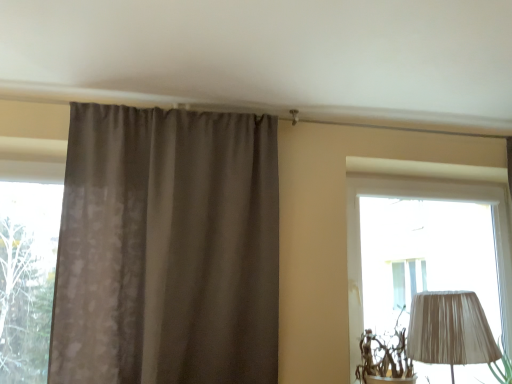
What do you see at coordinates (27, 278) in the screenshot? I see `transparent glass window at left` at bounding box center [27, 278].

Identify the location of transparent glass window at left. The width and height of the screenshot is (512, 384). (27, 278).

Identify the location of matte brown curtain at center. (167, 248).

The width and height of the screenshot is (512, 384). Describe the element at coordinates (167, 248) in the screenshot. I see `matte brown curtain at center` at that location.

Measure the distance between point (87,170) and camera.

Point (87,170) is 2.18 meters from camera.

Find the location of a particular element. The image size is (512, 384). transparent glass window at left is located at coordinates (27, 278).

In the scene shown: Is matte brown curtain at center to the left of transparent glass window at left from the viewer's perspective?

Incorrect, matte brown curtain at center is not on the left side of transparent glass window at left.

Is the depth of matte brown curtain at center greater than that of transparent glass window at left?

No, it is not.

Between point (148, 349) and point (10, 296), which one is positioned behind?

Positioned behind is point (10, 296).

In the scene shown: From the image's perspective, relative to transparent glass window at left, is matte brown curtain at center above or below?

matte brown curtain at center is above transparent glass window at left.

From a real-world perspective, is matte brown curtain at center physically above transparent glass window at left?

Yes, from a real-world perspective, matte brown curtain at center is above transparent glass window at left.

Which of these two, matte brown curtain at center or transparent glass window at left, is wider?

Wider between the two is matte brown curtain at center.

Can you confirm if matte brown curtain at center is shorter than transparent glass window at left?

Incorrect, the height of matte brown curtain at center does not fall short of that of transparent glass window at left.

Between matte brown curtain at center and transparent glass window at left, which one has larger size?

matte brown curtain at center is bigger.

Is matte brown curtain at center inside the boundaries of transparent glass window at left, or outside?

matte brown curtain at center lies outside transparent glass window at left.

Is matte brown curtain at center placed right next to transparent glass window at left?

No, matte brown curtain at center is not beside transparent glass window at left.

Could you tell me if matte brown curtain at center is turned towards transparent glass window at left?

No, matte brown curtain at center is not aimed at transparent glass window at left.

What's the angular difference between matte brown curtain at center and transparent glass window at left's facing directions?

The angle between the facing direction of matte brown curtain at center and the facing direction of transparent glass window at left is 0.88 degrees.

The image size is (512, 384). Find the location of `curtain located above the transparent glass window at left (from the image's perspective)`. curtain located above the transparent glass window at left (from the image's perspective) is located at coordinates (167, 248).

Which object is positioned more to the right, transparent glass window at left or matte brown curtain at center?

From the viewer's perspective, matte brown curtain at center appears more on the right side.

Is transparent glass window at left closer to the viewer compared to matte brown curtain at center?

No, it is not.

Between point (7, 216) and point (249, 359), which one is positioned behind?

The point (7, 216) is behind.

From the image's perspective, is transparent glass window at left over matte brown curtain at center?

No, from the image's perspective, transparent glass window at left is not over matte brown curtain at center.

From a real-world perspective, is transparent glass window at left on top of matte brown curtain at center?

No, from a real-world perspective, transparent glass window at left is not on top of matte brown curtain at center.

Based on the photo, does transparent glass window at left have a lesser width compared to matte brown curtain at center?

Indeed, transparent glass window at left has a lesser width compared to matte brown curtain at center.

Considering the sizes of objects transparent glass window at left and matte brown curtain at center in the image provided, who is shorter, transparent glass window at left or matte brown curtain at center?

transparent glass window at left.

Which of these two, transparent glass window at left or matte brown curtain at center, is bigger?

With larger size is matte brown curtain at center.

Is transparent glass window at left not inside matte brown curtain at center?

Yes, transparent glass window at left is not within matte brown curtain at center.

Would you consider transparent glass window at left to be distant from matte brown curtain at center?

That's not correct — transparent glass window at left is a little close to matte brown curtain at center.

Could you tell me if transparent glass window at left is turned towards matte brown curtain at center?

No, transparent glass window at left is not turned towards matte brown curtain at center.

What's the angular difference between transparent glass window at left and matte brown curtain at center's facing directions?

0.88 degrees.

You are a GUI agent. You are given a task and a screenshot of the screen. Output one action in this format:
    pyautogui.click(x=<x>, y=<y>)
    Task: Click on the window below the matte brown curtain at center (from the image's perspective)
    
    Given the screenshot: What is the action you would take?
    pyautogui.click(x=27, y=278)

Image resolution: width=512 pixels, height=384 pixels. Find the location of `curtain located above the transparent glass window at left (from the image's perspective)`. curtain located above the transparent glass window at left (from the image's perspective) is located at coordinates (167, 248).

This screenshot has height=384, width=512. In order to click on window on the left of matte brown curtain at center in this screenshot , I will do `click(27, 278)`.